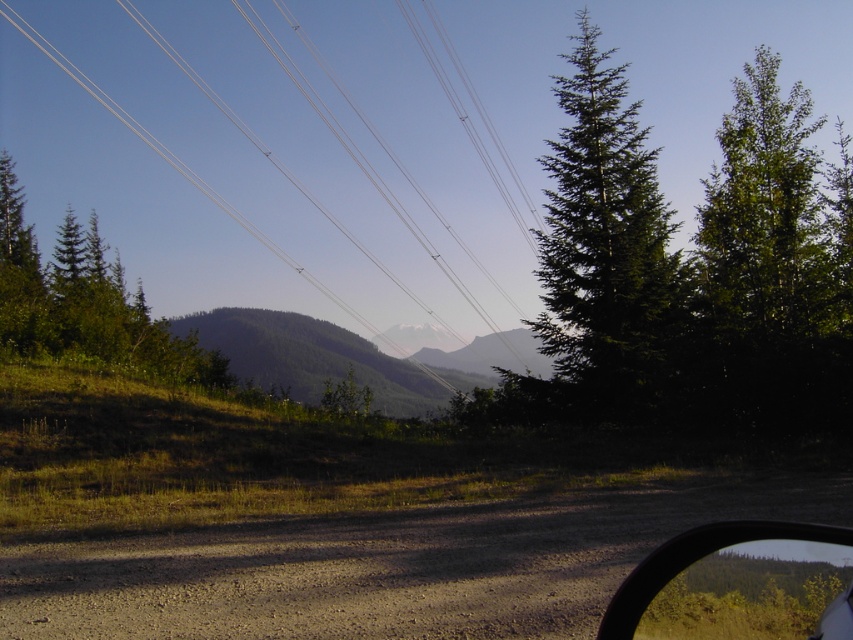
Question: Among these points, which one is nearest to the camera?

Choices:
 (A) (775, 552)
 (B) (451, 182)

Answer: (A)

Question: Is dirt/gravel road at lower center positioned at the back of green needle-like at right?

Choices:
 (A) yes
 (B) no

Answer: (B)

Question: Estimate the real-world distances between objects in this image. Which object is farther from the green grassy hill at center?

Choices:
 (A) green matte tree at upper left
 (B) green needle-like at right

Answer: (B)

Question: Which object appears closest to the camera in this image?

Choices:
 (A) dirt/gravel road at lower center
 (B) green needle-like at right
 (C) transparent glass car window at lower right
 (D) green matte tree at upper left

Answer: (C)

Question: Can you confirm if white wire at upper center is positioned to the left of green needle-like at right?

Choices:
 (A) no
 (B) yes

Answer: (B)

Question: Is dirt/gravel road at lower center positioned at the back of transparent glass car window at lower right?

Choices:
 (A) yes
 (B) no

Answer: (A)